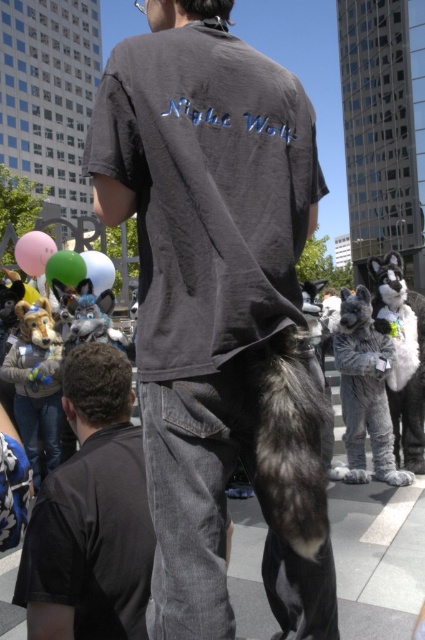
Question: Does gray furry dog at right come in front of green rubber balloon at center?

Choices:
 (A) no
 (B) yes

Answer: (B)

Question: Does dark gray t-shirt at center appear on the right side of white glossy balloon at center?

Choices:
 (A) no
 (B) yes

Answer: (B)

Question: Is dark gray t-shirt at center wider than pink rubber balloon at lower left?

Choices:
 (A) no
 (B) yes

Answer: (A)

Question: Which object is the farthest from the pink rubber balloon at lower left?

Choices:
 (A) green rubber balloon at center
 (B) dark gray t-shirt at center
 (C) fuzzy gray wolf at center
 (D) white glossy balloon at center

Answer: (B)

Question: Among these points, which one is nearest to the camera?

Choices:
 (A) (39, 243)
 (B) (393, 349)
 (C) (396, 448)
 (D) (54, 273)

Answer: (B)

Question: Which point is farther to the camera?

Choices:
 (A) pink rubber balloon at lower left
 (B) white glossy balloon at center

Answer: (A)